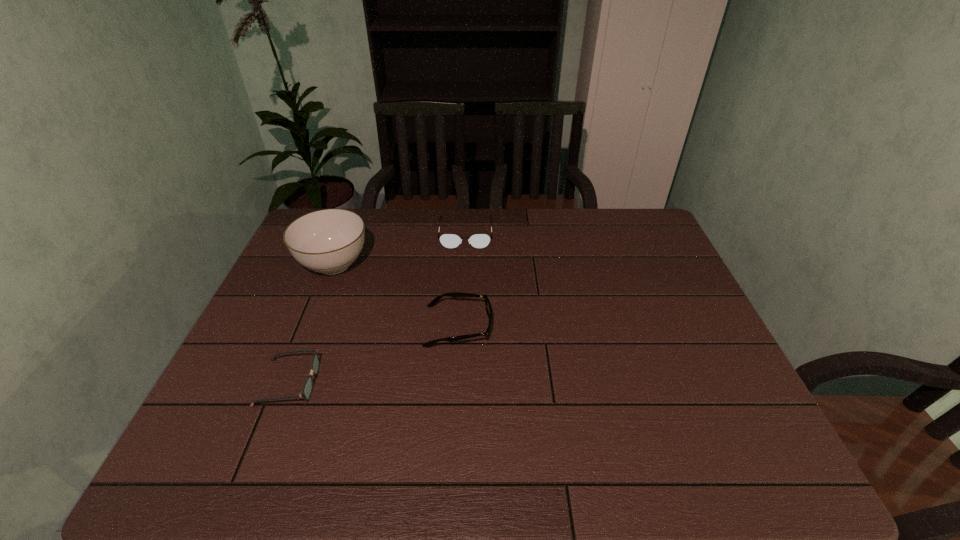
This screenshot has width=960, height=540. What are the coordinates of `the tallest object` in the screenshot? It's located at point(327,241).

Locate an element on the screen. the farthest spectacles is located at coordinates (479, 241).

In order to click on the second farthest spectacles in this screenshot , I will do `click(487, 303)`.

At what (x,y) coordinates should I click in order to perform the action: click on the nearest object. Please return your answer as a coordinate pair (x, y). This screenshot has height=540, width=960. Looking at the image, I should click on 307,389.

Where is `the nearest spectacles`? The height and width of the screenshot is (540, 960). the nearest spectacles is located at coordinates (307, 389).

The height and width of the screenshot is (540, 960). Identify the location of vacant space located 0.400m on the front of the tallest object. (276, 408).

Locate an element on the screen. vacant area located on the lenses of the farthest spectacles is located at coordinates (463, 298).

This screenshot has width=960, height=540. What are the coordinates of `free space located on the front-facing side of the second nearest spectacles` in the screenshot? It's located at (525, 326).

This screenshot has height=540, width=960. Identify the location of free space located 0.360m on the face of the leftmost spectacles. (468, 382).

At what (x,y) coordinates should I click in order to perform the action: click on chinaware present at the far edge. Please return your answer as a coordinate pair (x, y). The width and height of the screenshot is (960, 540). Looking at the image, I should click on (327, 241).